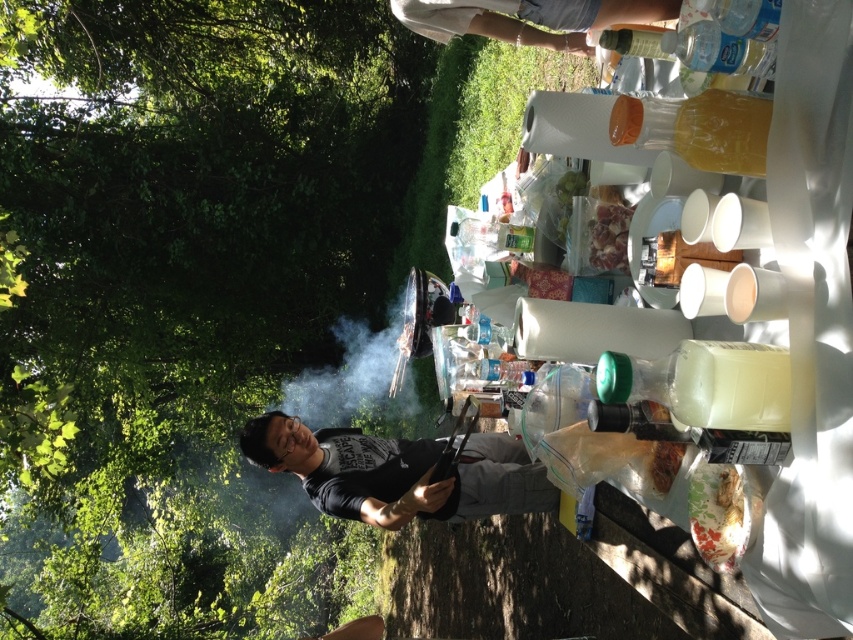
You are at a barbecue and need to identify which item is bigger between the black matte shirt at center and the clear plastic bottle at upper center. Which one is larger?

The black matte shirt at center is larger in size than the clear plastic bottle at upper center.

You are standing at the barbecue table and want to reach both the orange juice bottle and another item. The orange juice bottle is located at point (228, 458) and the other item is at point (543, 44). Which item will you reach first if you move towards them directly?

The orange juice bottle at point (228, 458) will be reached first because it is closer to you than the item at point (543, 44).